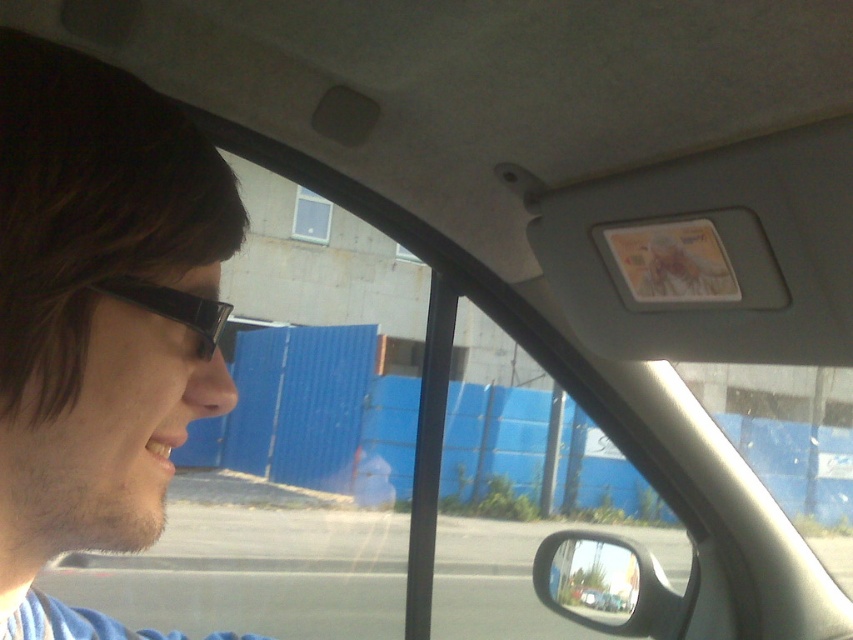
Question: Is glossy black side mirror at lower right positioned at the back of black plastic glasses at left?

Choices:
 (A) yes
 (B) no

Answer: (A)

Question: Is brown matte hair at upper left to the left of black plastic glasses at left from the viewer's perspective?

Choices:
 (A) no
 (B) yes

Answer: (B)

Question: Estimate the real-world distances between objects in this image. Which object is closer to the black plastic glasses at left?

Choices:
 (A) glossy black side mirror at lower right
 (B) brown matte hair at upper left

Answer: (B)

Question: Which point appears farthest from the camera in this image?

Choices:
 (A) (564, 529)
 (B) (157, 314)
 (C) (70, 232)

Answer: (A)

Question: Does brown matte hair at upper left have a lesser width compared to black plastic glasses at left?

Choices:
 (A) no
 (B) yes

Answer: (A)

Question: Which object appears farthest from the camera in this image?

Choices:
 (A) glossy black side mirror at lower right
 (B) black plastic glasses at left

Answer: (A)